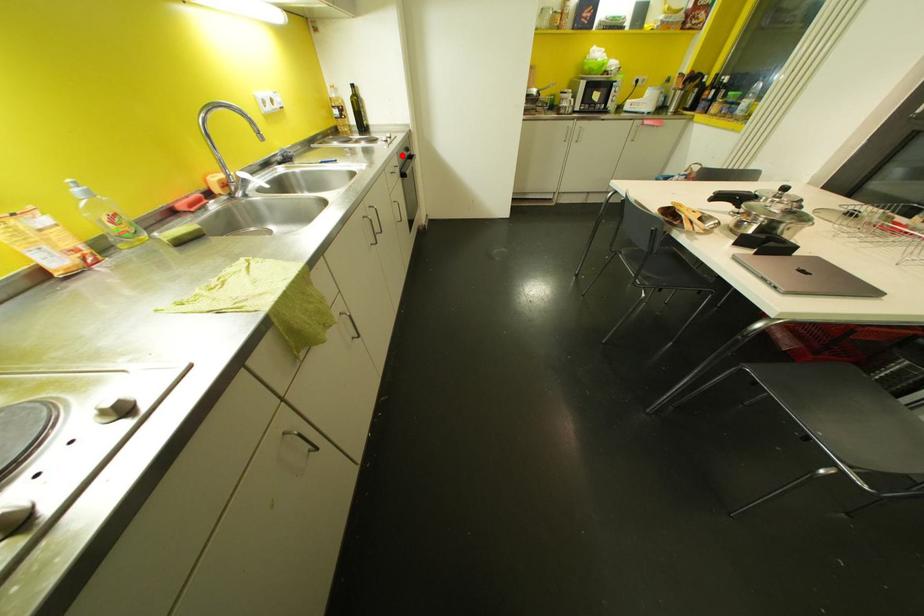
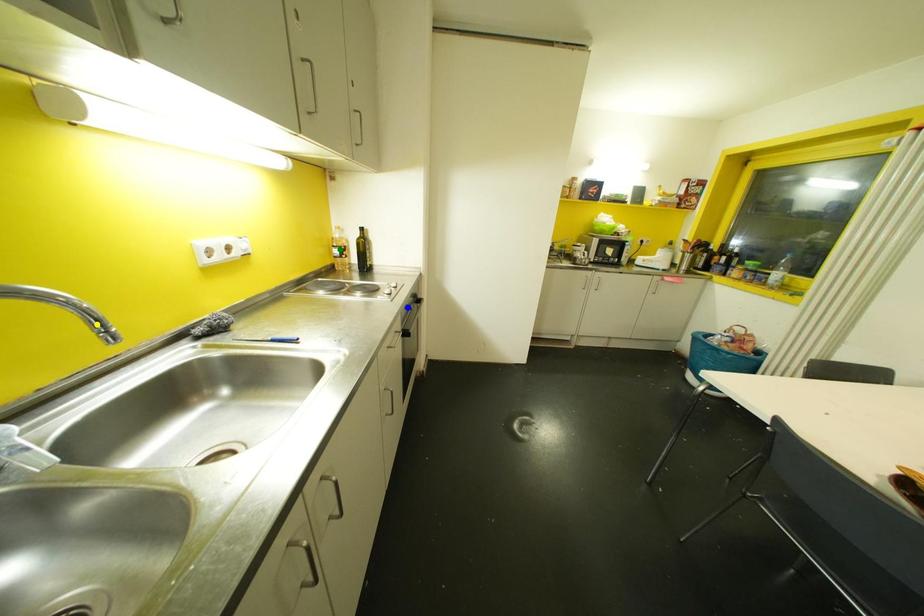
Question: I am providing you with two images of the same scene from different viewpoints. A red point is marked on the first image. You are given multiple points on the second image. Which point in image 2 represents the same 3d spot as the red point in image 1?

Choices:
 (A) blue point
 (B) yellow point
 (C) green point

Answer: (A)